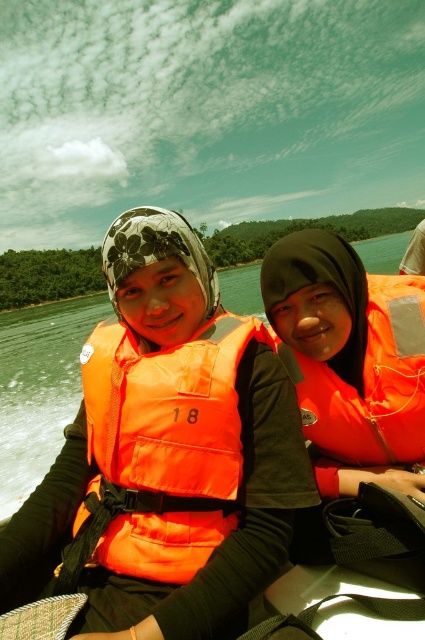
You are a safety inspector checking the placement of the orange fabric life vest at center on a boat. The coordinates given are point (166, 444). Based on the scene description, where exactly is the orange fabric life vest at center located?

The orange fabric life vest at center is located at point (166, 444).

Looking at this image, you are standing on the dock and want to throw a 1.5 meter long rope to the orange fabric life vest at center. Can you reach it without moving closer?

The orange fabric life vest at center is 1.80 meters away from the viewer. Since the rope is 1.5 meters long, it is shorter than the distance required. Therefore, you cannot reach the orange fabric life vest at center with the rope without moving closer.